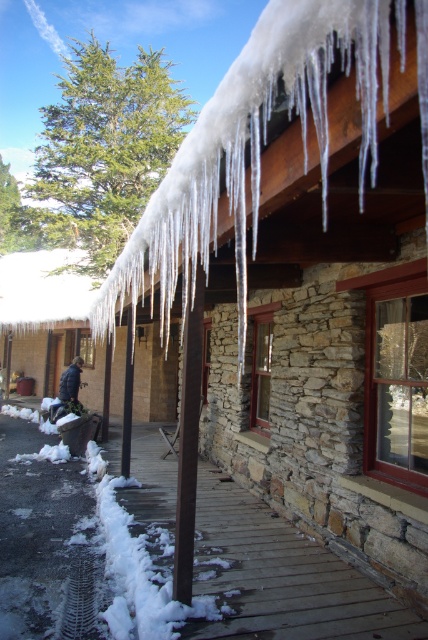
Question: Can you confirm if icy white snow at upper center is positioned above dark blue jacket at lower left?

Choices:
 (A) yes
 (B) no

Answer: (A)

Question: Which is farther from the dark blue jacket at lower left?

Choices:
 (A) white snow-covered roof at upper left
 (B) icy white snow at upper center

Answer: (A)

Question: Where is white snow-covered roof at upper left located in relation to dark blue jacket at lower left in the image?

Choices:
 (A) above
 (B) below

Answer: (A)

Question: Estimate the real-world distances between objects in this image. Which object is closer to the icy white snow at upper center?

Choices:
 (A) white snow-covered roof at upper left
 (B) dark blue jacket at lower left

Answer: (B)

Question: Is icy white snow at upper center to the left of white snow-covered roof at upper left from the viewer's perspective?

Choices:
 (A) yes
 (B) no

Answer: (B)

Question: Among these points, which one is nearest to the camera?

Choices:
 (A) (77, 387)
 (B) (50, 269)
 (C) (386, 77)

Answer: (C)